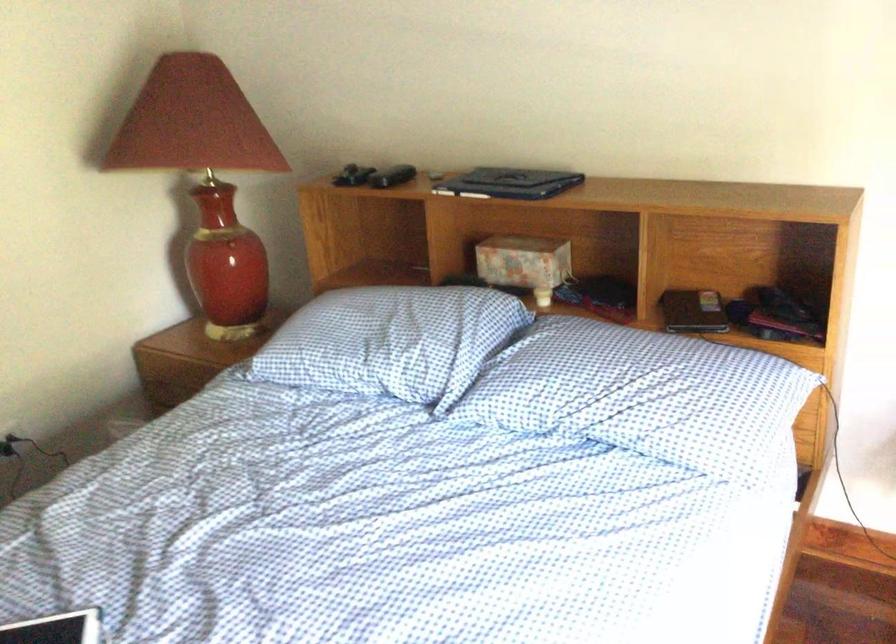
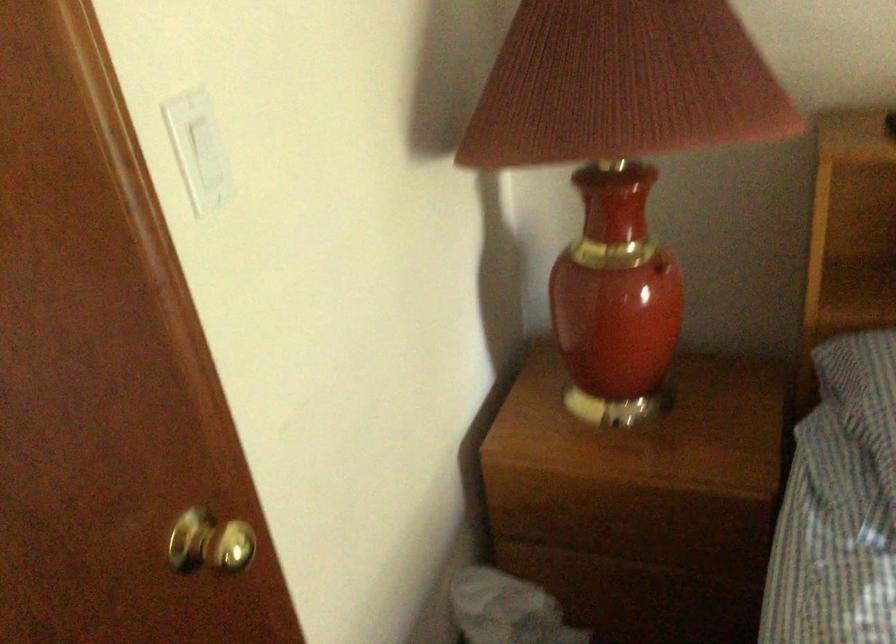
Where in the second image is the point corresponding to [225,232] from the first image?

(661, 267)